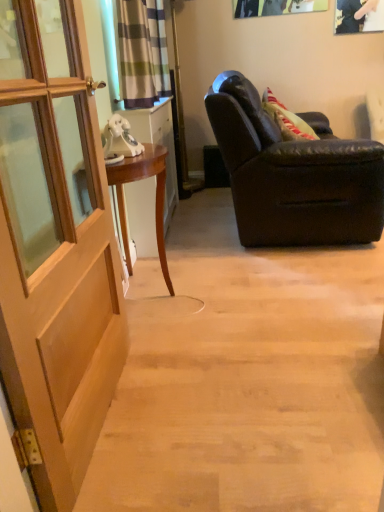
Where is `free space to the right of light brown wood door at left`? The image size is (384, 512). free space to the right of light brown wood door at left is located at coordinates (218, 404).